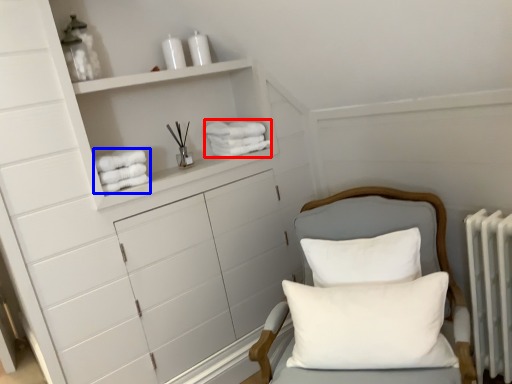
Question: Which object is closer to the camera taking this photo, bath towel (highlighted by a red box) or bath towel (highlighted by a blue box)?

Choices:
 (A) bath towel
 (B) bath towel

Answer: (B)